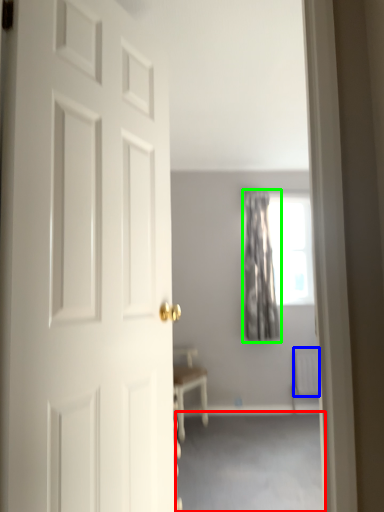
Question: Which object is the farthest from corridor (highlighted by a red box)? Choose among these: radiator (highlighted by a blue box) or curtain (highlighted by a green box).

Choices:
 (A) radiator
 (B) curtain

Answer: (B)